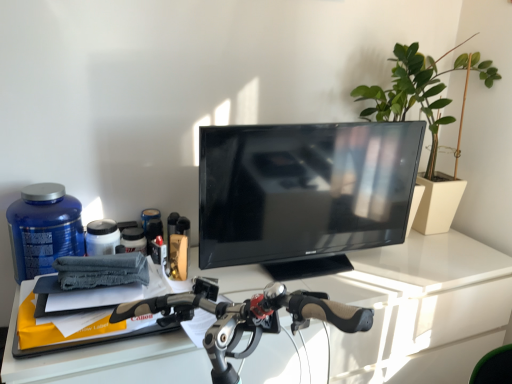
You are a GUI agent. You are given a task and a screenshot of the screen. Output one action in this format:
    pyautogui.click(x=<x>, y=<y>)
    Task: Click on the vacant region below black glossy tv at center (from a real-world perspective)
    The height and width of the screenshot is (384, 512).
    Given the screenshot: What is the action you would take?
    pyautogui.click(x=305, y=262)